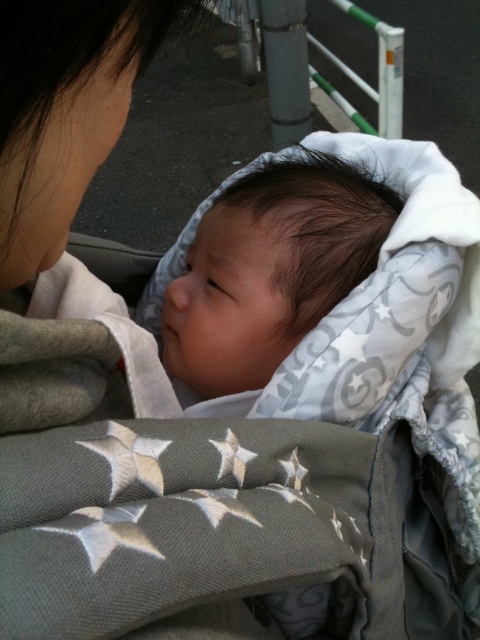
Question: Does soft gray blanket at center appear on the right side of gray fabric at upper left?

Choices:
 (A) no
 (B) yes

Answer: (B)

Question: Can you confirm if soft gray blanket at center is wider than gray fabric at upper left?

Choices:
 (A) yes
 (B) no

Answer: (A)

Question: Which point is closer to the camera?

Choices:
 (A) (80, 74)
 (B) (247, 209)

Answer: (A)

Question: Which object appears farthest from the camera in this image?

Choices:
 (A) soft gray blanket at center
 (B) gray fabric at upper left

Answer: (A)

Question: Can you confirm if soft gray blanket at center is positioned below gray fabric at upper left?

Choices:
 (A) no
 (B) yes

Answer: (B)